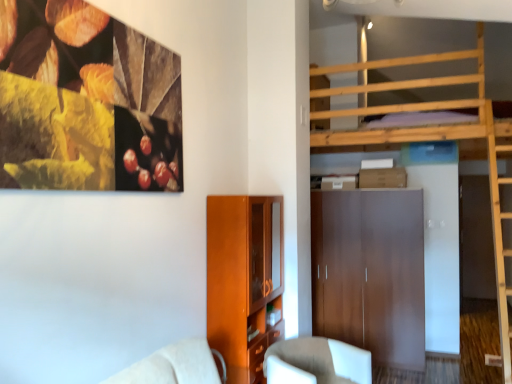
Question: From the image's perspective, is matte brown wardrobe at center above or below matte wood cabinet at lower center?

Choices:
 (A) below
 (B) above

Answer: (A)

Question: Is matte brown wardrobe at center spatially inside matte wood cabinet at lower center, or outside of it?

Choices:
 (A) inside
 (B) outside

Answer: (B)

Question: Considering the real-world distances, which object is closest to the matte wood cabinet at lower center?

Choices:
 (A) white fabric chair at lower center
 (B) matte brown wardrobe at center

Answer: (A)

Question: Estimate the real-world distances between objects in this image. Which object is farther from the white fabric chair at lower center?

Choices:
 (A) matte wood cabinet at lower center
 (B) matte brown wardrobe at center

Answer: (B)